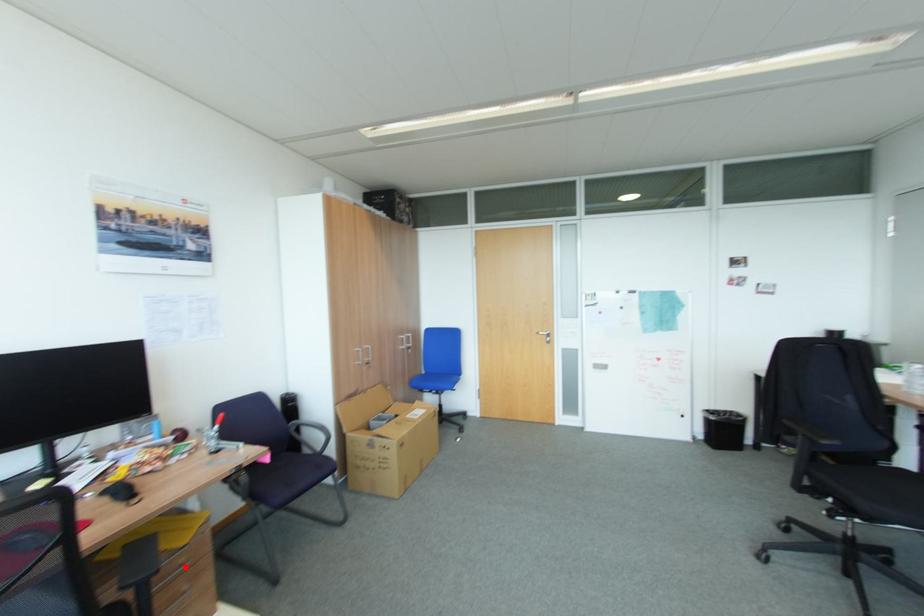
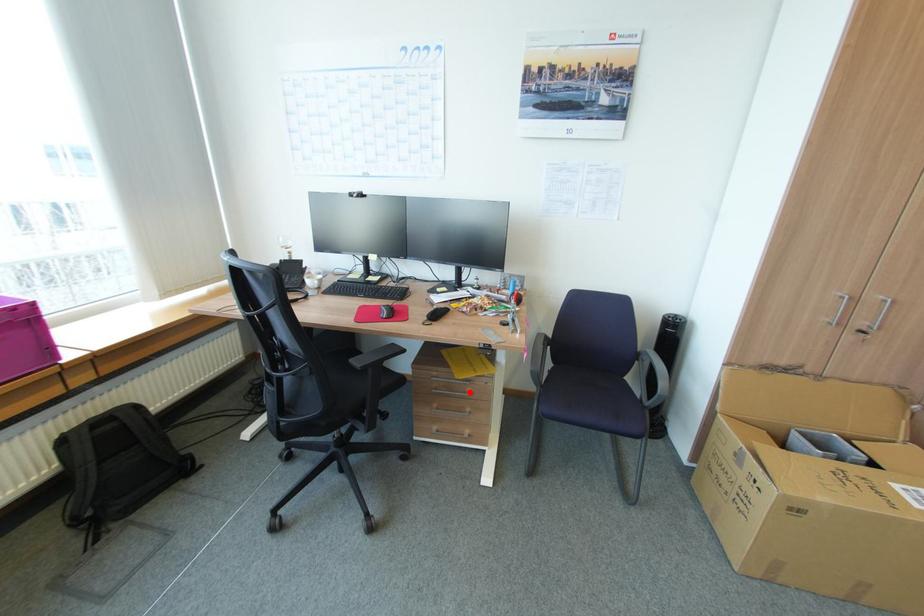
I am providing you with two images of the same scene from different viewpoints. A red point is marked on the first image and another point is marked on the second image. Are the points marked in image1 and image2 representing the same 3D position?

Yes